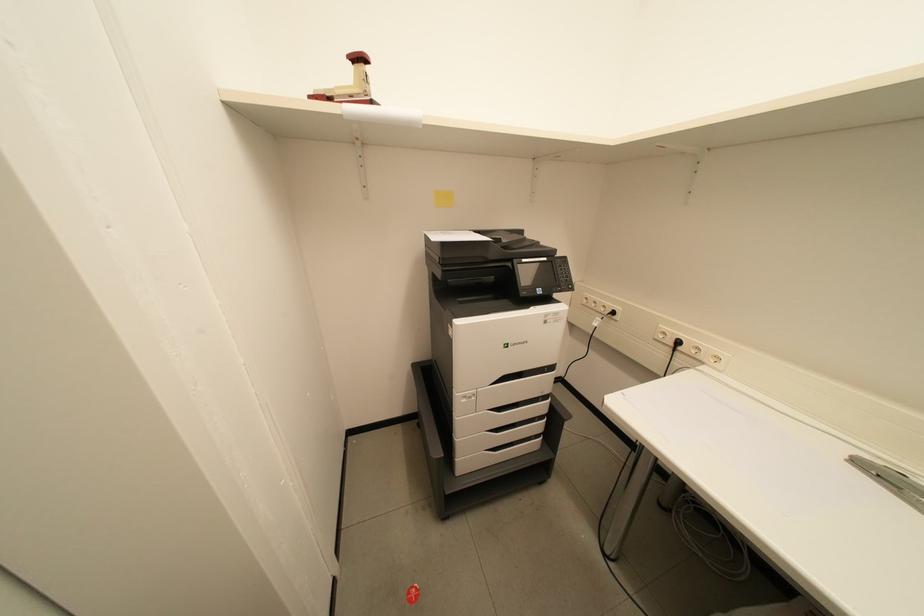
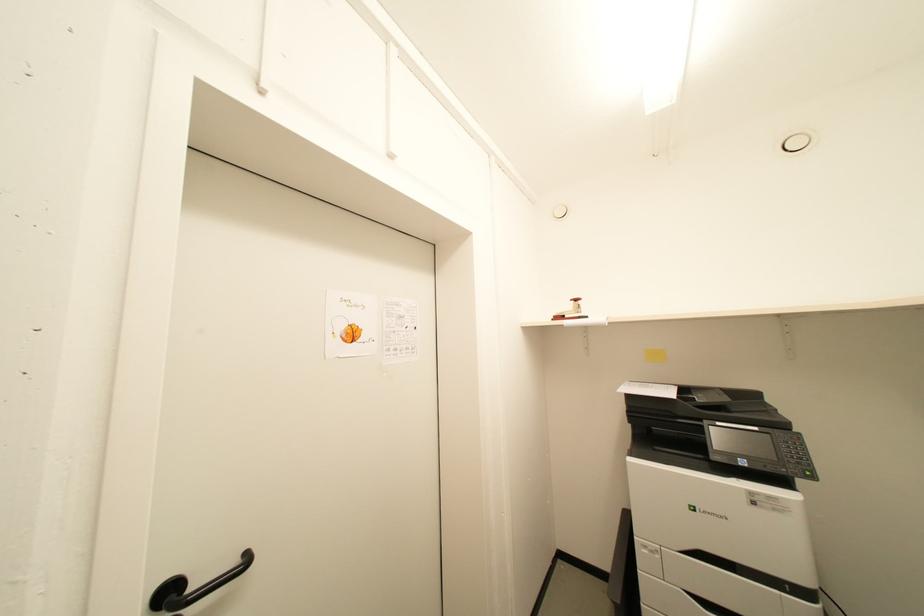
The first image is from the beginning of the video and the second image is from the end. How did the camera likely rotate when shooting the video?

The rotation direction of the camera is left-up.